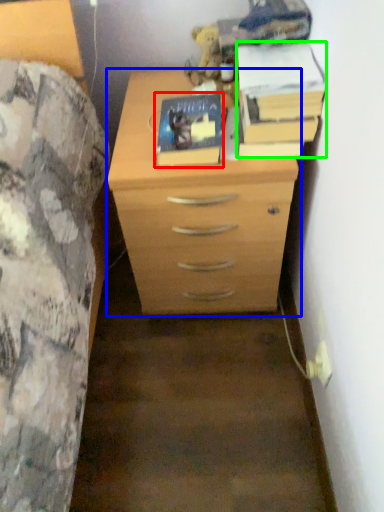
Question: Which object is the farthest from paperback book (highlighted by a red box)? Choose among these: chest of drawers (highlighted by a blue box) or paperback book (highlighted by a green box).

Choices:
 (A) chest of drawers
 (B) paperback book

Answer: (A)